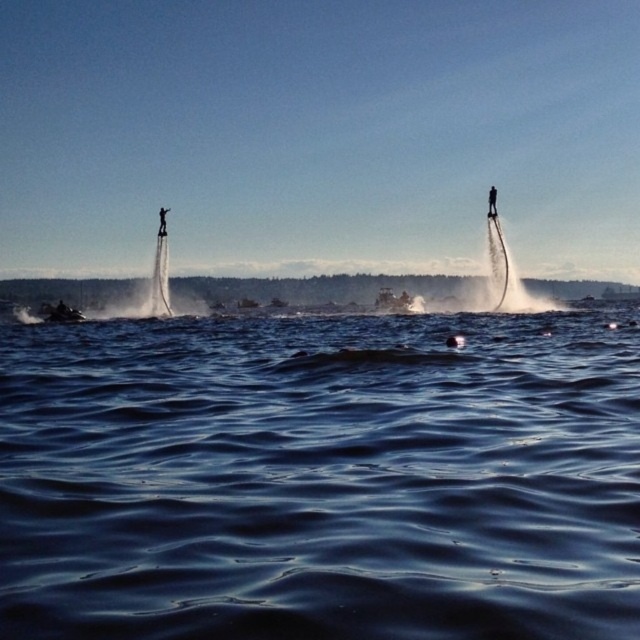
You are a safety officer overseeing a flyboarding session. You need to ensure that the black matte jetpack at left is positioned at least 200 feet away from the dark blue water at center for safety. Based on the scene, is the current distance compliant with safety regulations?

The distance between the dark blue water at center and the black matte jetpack at left is 179.64 feet, which is less than the required 200 feet. Therefore, the current positioning does not comply with safety regulations and needs adjustment.

You are a photographer trying to capture both the brushed metal jet ski at lower left and the black matte flyboard at upper right in the same frame. Based on their sizes, which object will appear bigger in your photo?

The brushed metal jet ski at lower left will appear bigger in the photo because it is larger in size than the black matte flyboard at upper right.